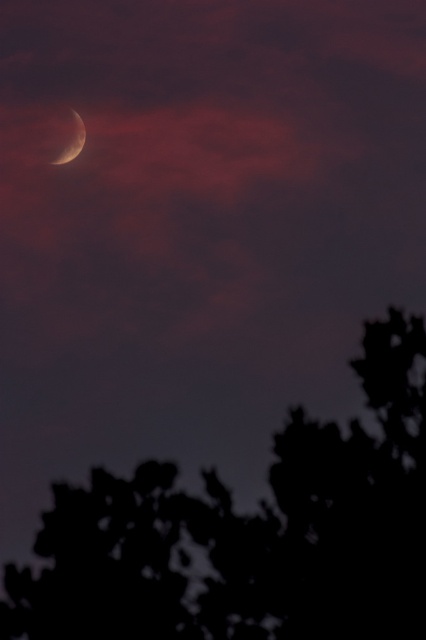
Consider the image. Does silhouette leafy tree at upper left have a lesser height compared to satin silver crescent at upper left?

Correct, silhouette leafy tree at upper left is not as tall as satin silver crescent at upper left.

Find the location of a particular element. silhouette leafy tree at upper left is located at coordinates (252, 532).

Who is more distant from viewer, (43, 573) or (43, 122)?

The point (43, 122) is behind.

You are a GUI agent. You are given a task and a screenshot of the screen. Output one action in this format:
    pyautogui.click(x=<x>, y=<y>)
    Task: Click on the silhouette leafy tree at upper left
    Image resolution: width=426 pixels, height=640 pixels.
    Given the screenshot: What is the action you would take?
    pyautogui.click(x=252, y=532)